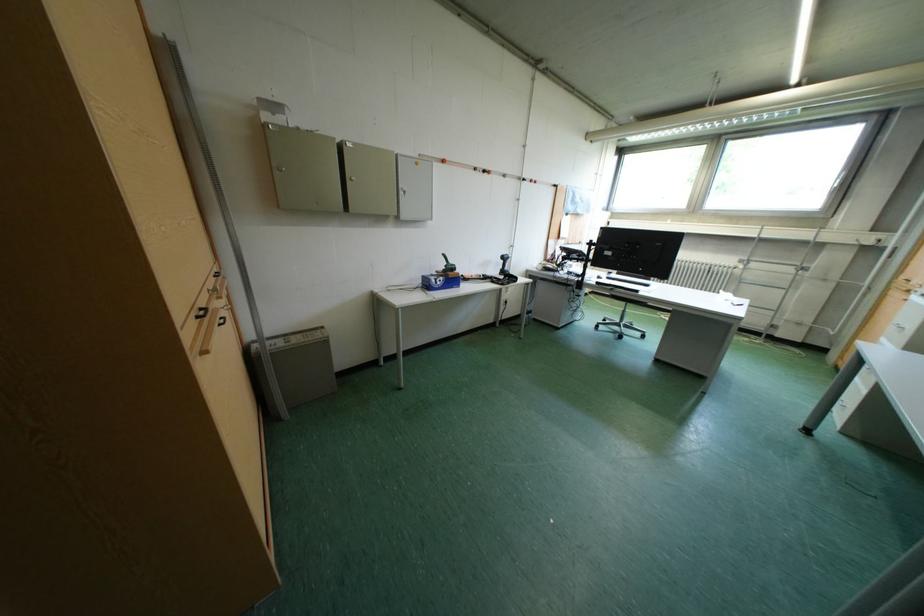
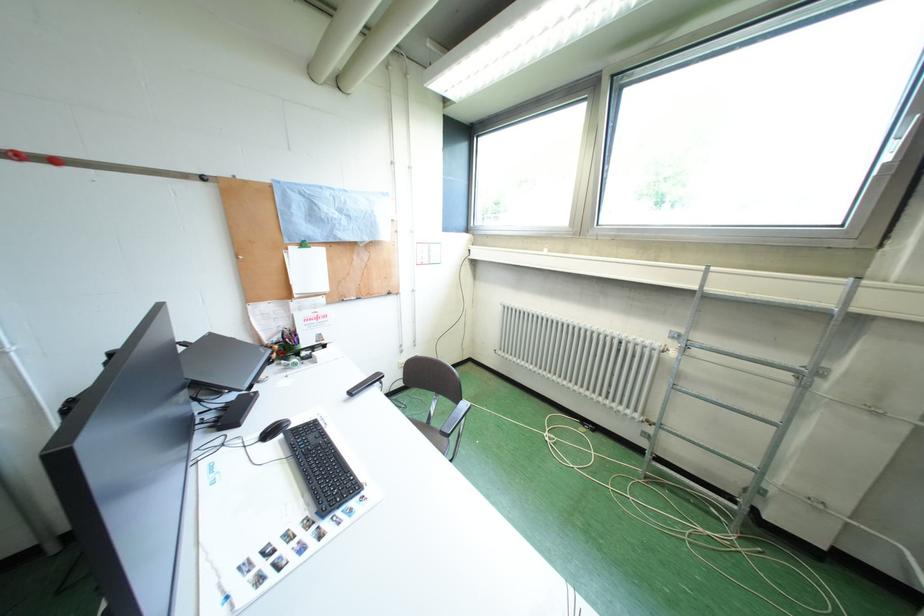
In a continuous first-person perspective shot, in which direction is the camera moving?

The cameraman walked toward right, forward.